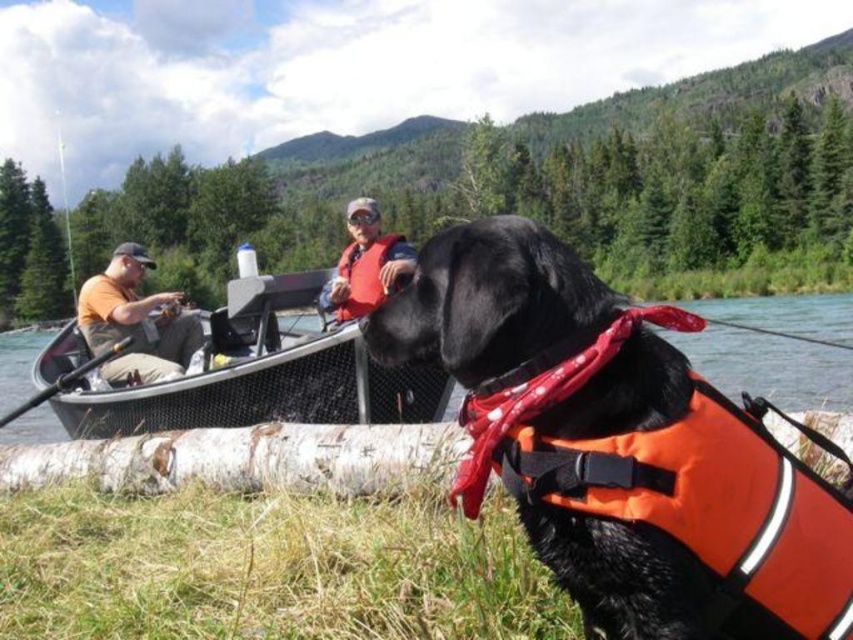
Question: Is black rubber boat at center further to camera compared to matte orange life vest at center?

Choices:
 (A) yes
 (B) no

Answer: (A)

Question: Is black rubber boat at center to the left of matte orange life vest at center from the viewer's perspective?

Choices:
 (A) no
 (B) yes

Answer: (B)

Question: Based on their relative distances, which object is farther from the matte orange life vest at center?

Choices:
 (A) black rubber boat at center
 (B) orange cotton shirt at left

Answer: (A)

Question: In this image, where is shiny orange life vest at center located relative to orange cotton shirt at left?

Choices:
 (A) below
 (B) above

Answer: (A)

Question: Which of these objects is positioned farthest from the shiny orange life vest at center?

Choices:
 (A) orange cotton shirt at left
 (B) black rubber boat at center

Answer: (B)

Question: Among these points, which one is nearest to the camera?

Choices:
 (A) (637, 566)
 (B) (378, 472)
 (C) (107, 308)
 (D) (798, 316)

Answer: (A)